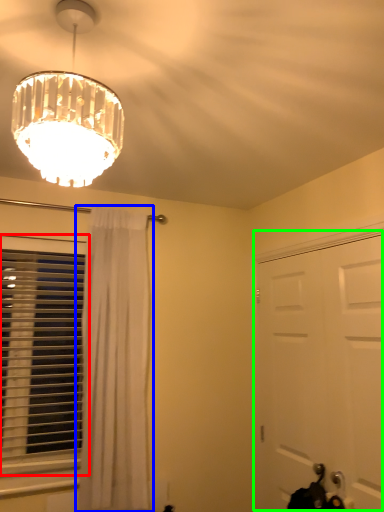
Question: Considering the real-world distances, which object is closest to window (highlighted by a red box)? curtain (highlighted by a blue box) or door (highlighted by a green box).

Choices:
 (A) curtain
 (B) door

Answer: (A)